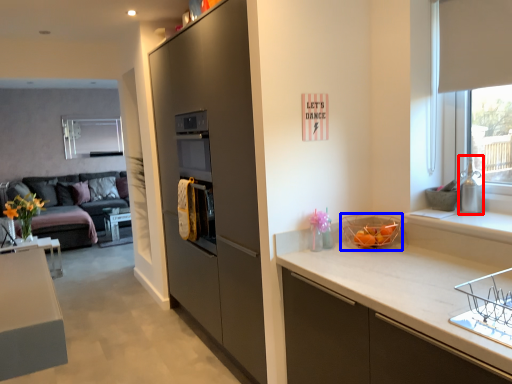
Question: Among these objects, which one is nearest to the camera, appliance (highlighted by a red box) or basket (highlighted by a blue box)?

Choices:
 (A) appliance
 (B) basket

Answer: (A)